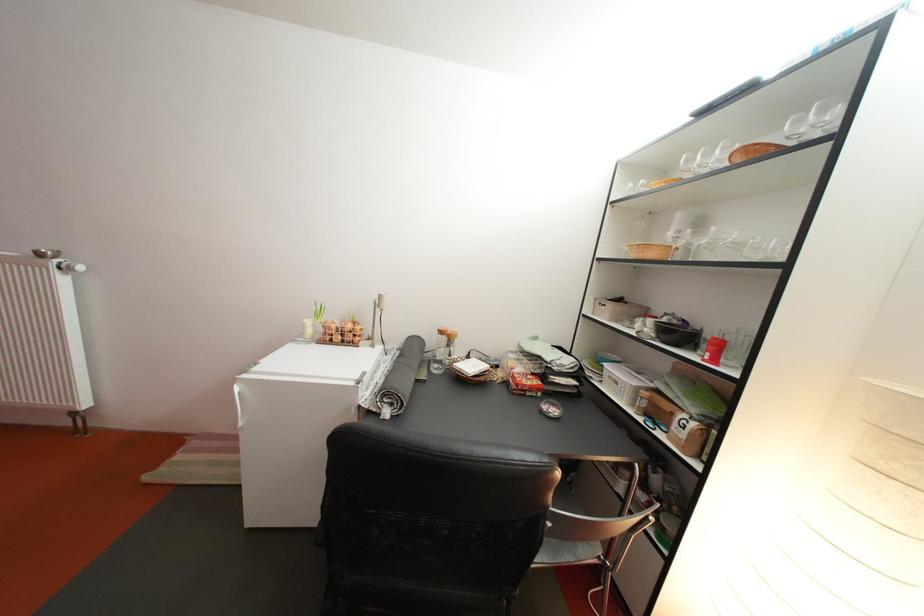
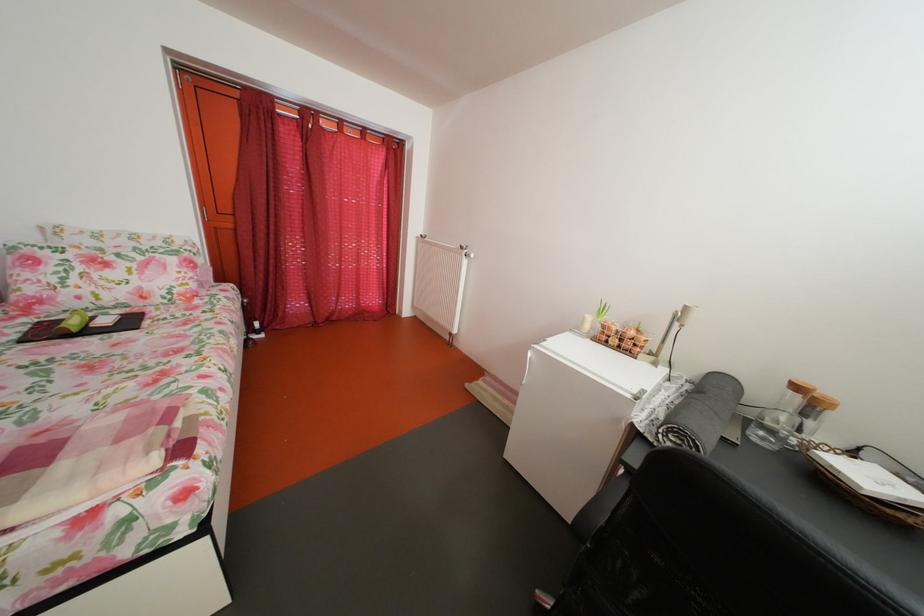
Where in the second image is the point corresponding to (x=259, y=531) from the first image?

(517, 463)